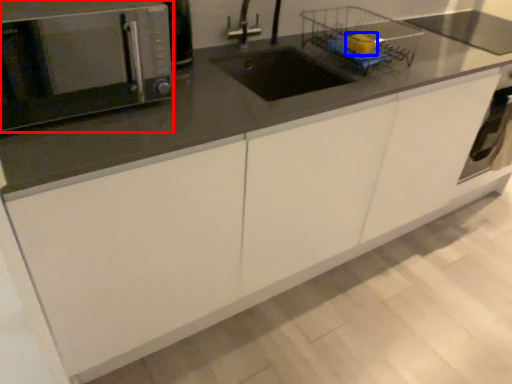
Question: Which object appears farthest to the camera in this image, microwave oven (highlighted by a red box) or food (highlighted by a blue box)?

Choices:
 (A) microwave oven
 (B) food

Answer: (B)